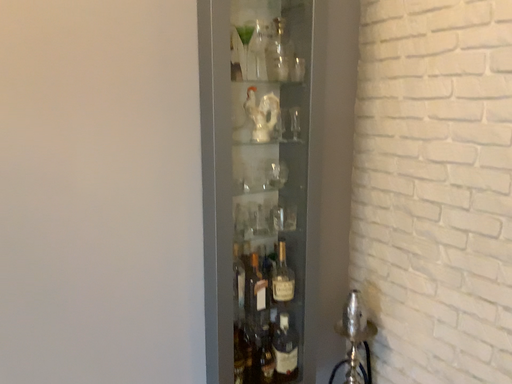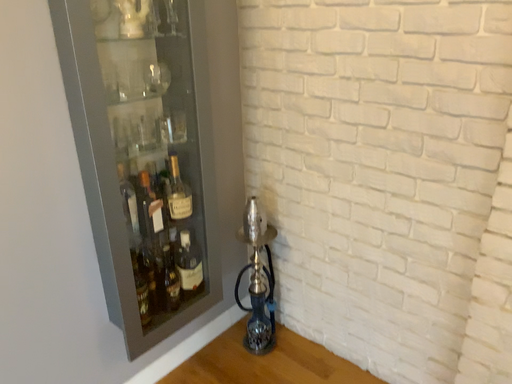
Question: How did the camera likely rotate when shooting the video?

Choices:
 (A) rotated left
 (B) rotated right

Answer: (B)